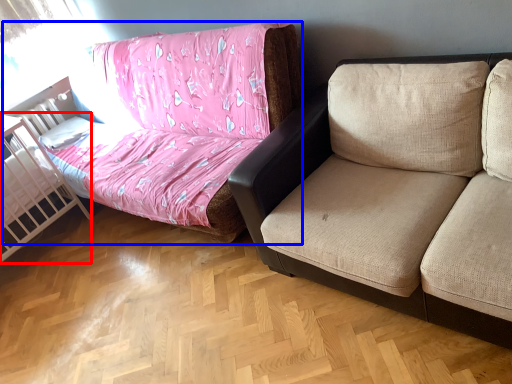
Question: Among these objects, which one is farthest to the camera, infant bed (highlighted by a red box) or studio couch (highlighted by a blue box)?

Choices:
 (A) infant bed
 (B) studio couch

Answer: (A)